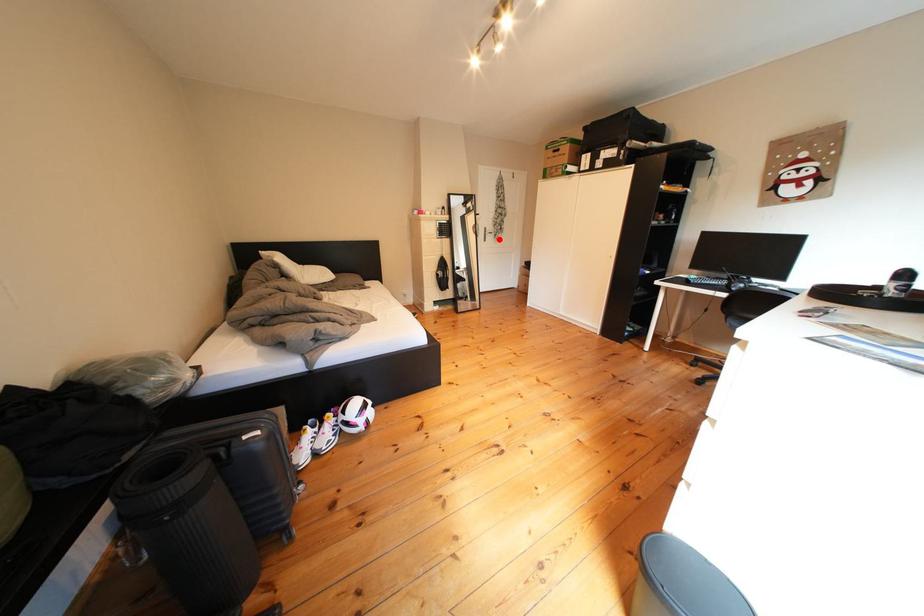
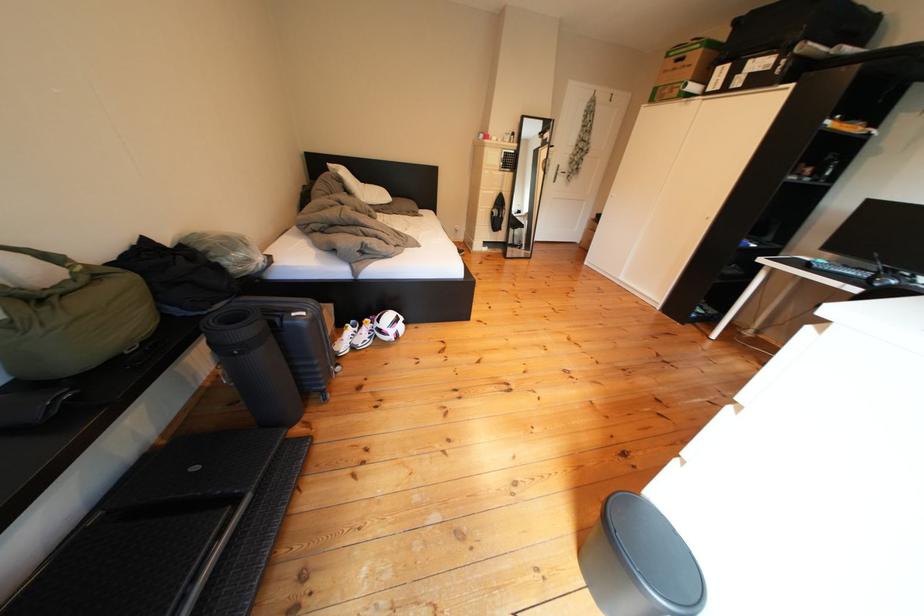
Question: I am providing you with two images of the same scene from different viewpoints. Image1 has a red point marked. In image2, the corresponding 3D location appears at what relative position? Reply with the corresponding letter.

Choices:
 (A) Closer
 (B) Farther

Answer: (A)